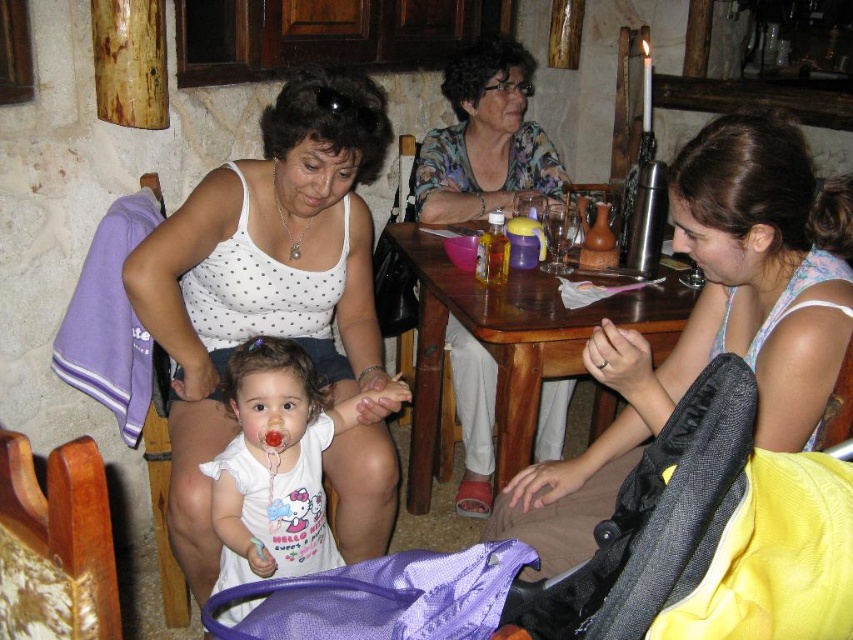
You are standing in the room and want to move from point (367,422) to point (796,179). Which direction should you move in to get closer to the second point?

You should move towards the upper left direction because point (796,179) is located in the upper left relative to point (367,422).

You are a photographer trying to capture a candid shot of the two women in the scene. Since you want to focus on the woman in the white dotted tank top at center, which object should you avoid blocking the view of with the floral fabric blouse at upper center?

The white dotted tank top at center is in front of the floral fabric blouse at upper center, so to avoid blocking the view of the white dotted tank top at center, you should ensure the floral fabric blouse at upper center does not obscure it. However, since the white dotted tank top is already in front, positioning yourself so that the floral fabric blouse at upper center is behind it would maintain the focus on the desired subject.